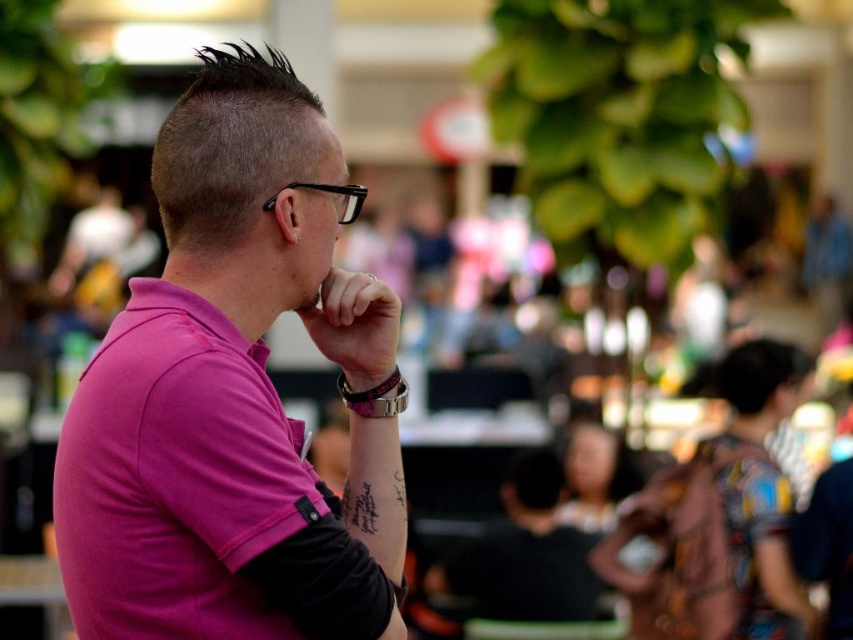
Between point (384, 284) and point (270, 198), which one is positioned behind?

Point (384, 284)

Does matte black wristwatch at center have a lesser width compared to black plastic glasses at upper left?

No.

Does point (355, 333) lie behind point (325, 186)?

Yes, it is behind point (325, 186).

Identify the location of matte black wristwatch at center. This screenshot has width=853, height=640. (354, 324).

Who is higher up, pink matte shirt at center or matte black wristwatch at center?

Positioned higher is matte black wristwatch at center.

Which is below, pink matte shirt at center or matte black wristwatch at center?

Positioned lower is pink matte shirt at center.

Locate an element on the screen. This screenshot has width=853, height=640. pink matte shirt at center is located at coordinates (235, 396).

Who is more forward, (x=144, y=618) or (x=358, y=195)?

Point (x=144, y=618) is in front.

Who is more distant from viewer, (289, 632) or (265, 202)?

The point (265, 202) is more distant.

Find the location of a particular element. pink matte shirt at center is located at coordinates (235, 396).